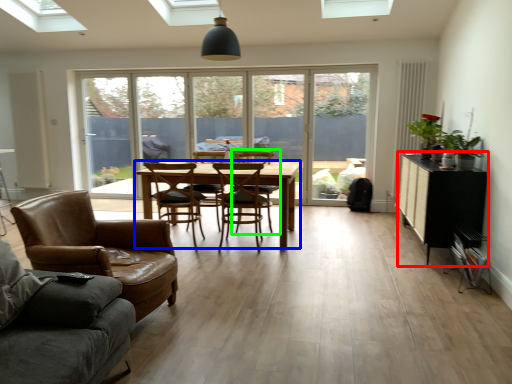
Question: Based on their relative distances, which object is farther from table (highlighted by a red box)? Choose from kitchen & dining room table (highlighted by a blue box) and armchair (highlighted by a green box).

Choices:
 (A) kitchen & dining room table
 (B) armchair

Answer: (B)